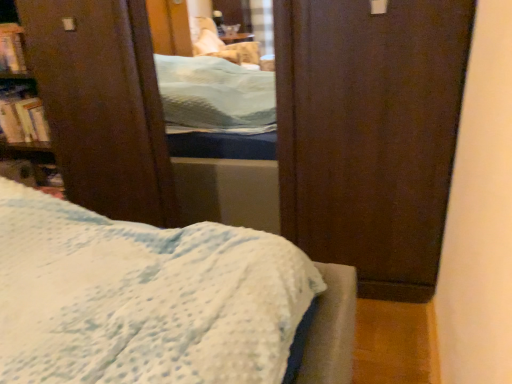
The width and height of the screenshot is (512, 384). In order to click on hardcover book at left, which is the 2th book from top to bottom in this screenshot , I will do `click(22, 116)`.

Describe the element at coordinates (22, 116) in the screenshot. I see `hardcover book at left, which is the 2th book from top to bottom` at that location.

How much space does hardcover book at upper left, positioned as the second book in bottom-to-top order, occupy horizontally?

It is 7.41 inches.

In order to face hardcover book at upper left, positioned as the second book in bottom-to-top order, should I rotate leftwards or rightwards?

Turn left by 31.420 degrees to look at hardcover book at upper left, positioned as the second book in bottom-to-top order.

Where is `hardcover book at upper left, placed as the 1th book when sorted from top to bottom`? hardcover book at upper left, placed as the 1th book when sorted from top to bottom is located at coordinates (12, 49).

The height and width of the screenshot is (384, 512). Describe the element at coordinates (12, 49) in the screenshot. I see `hardcover book at upper left, positioned as the second book in bottom-to-top order` at that location.

Find the location of a particular element. The height and width of the screenshot is (384, 512). hardcover book at left, which is the 2th book from top to bottom is located at coordinates (22, 116).

Is hardcover book at upper left, positioned as the second book in bottom-to-top order, to the right of hardcover book at left, which is the 2th book from top to bottom, from the viewer's perspective?

Incorrect, hardcover book at upper left, positioned as the second book in bottom-to-top order, is not on the right side of hardcover book at left, which is the 2th book from top to bottom.

Considering their positions, is hardcover book at upper left, positioned as the second book in bottom-to-top order, located in front of or behind hardcover book at left, which is the 2th book from top to bottom?

hardcover book at upper left, positioned as the second book in bottom-to-top order, is positioned closer to the viewer than hardcover book at left, which is the 2th book from top to bottom.

Does point (18, 72) lie behind point (17, 90)?

That is False.

From the image's perspective, is hardcover book at upper left, placed as the 1th book when sorted from top to bottom, positioned above or below hardcover book at left, marked as the 1th book in a bottom-to-top arrangement?

Clearly, from the image's perspective, hardcover book at upper left, placed as the 1th book when sorted from top to bottom, is above hardcover book at left, marked as the 1th book in a bottom-to-top arrangement.

From a real-world perspective, relative to hardcover book at left, marked as the 1th book in a bottom-to-top arrangement, is hardcover book at upper left, positioned as the second book in bottom-to-top order, vertically above or below?

Clearly, from a real-world perspective, hardcover book at upper left, positioned as the second book in bottom-to-top order, is above hardcover book at left, marked as the 1th book in a bottom-to-top arrangement.

Considering the relative sizes of hardcover book at upper left, placed as the 1th book when sorted from top to bottom, and hardcover book at left, marked as the 1th book in a bottom-to-top arrangement, in the image provided, is hardcover book at upper left, placed as the 1th book when sorted from top to bottom, thinner than hardcover book at left, marked as the 1th book in a bottom-to-top arrangement,?

Indeed, hardcover book at upper left, placed as the 1th book when sorted from top to bottom, has a lesser width compared to hardcover book at left, marked as the 1th book in a bottom-to-top arrangement.

Between hardcover book at upper left, positioned as the second book in bottom-to-top order, and hardcover book at left, which is the 2th book from top to bottom, which one has less height?

With less height is hardcover book at left, which is the 2th book from top to bottom.

Who is smaller, hardcover book at upper left, positioned as the second book in bottom-to-top order, or hardcover book at left, marked as the 1th book in a bottom-to-top arrangement?

Smaller between the two is hardcover book at left, marked as the 1th book in a bottom-to-top arrangement.

Is hardcover book at left, which is the 2th book from top to bottom, completely or partially inside hardcover book at upper left, placed as the 1th book when sorted from top to bottom?

That's incorrect, hardcover book at left, which is the 2th book from top to bottom, is not inside hardcover book at upper left, placed as the 1th book when sorted from top to bottom.

Can you see hardcover book at upper left, positioned as the second book in bottom-to-top order, touching hardcover book at left, which is the 2th book from top to bottom?

No, hardcover book at upper left, positioned as the second book in bottom-to-top order, is not with hardcover book at left, which is the 2th book from top to bottom.

Is hardcover book at upper left, positioned as the second book in bottom-to-top order, oriented towards hardcover book at left, which is the 2th book from top to bottom?

No, hardcover book at upper left, positioned as the second book in bottom-to-top order, is not facing towards hardcover book at left, which is the 2th book from top to bottom.

Where is `book below the hardcover book at upper left, positioned as the second book in bottom-to-top order (from the image's perspective)`? book below the hardcover book at upper left, positioned as the second book in bottom-to-top order (from the image's perspective) is located at coordinates tap(22, 116).

Would you say hardcover book at left, marked as the 1th book in a bottom-to-top arrangement, is to the left or to the right of hardcover book at upper left, placed as the 1th book when sorted from top to bottom, in the picture?

In the image, hardcover book at left, marked as the 1th book in a bottom-to-top arrangement, appears on the right side of hardcover book at upper left, placed as the 1th book when sorted from top to bottom.

Which object is more forward, hardcover book at left, which is the 2th book from top to bottom, or hardcover book at upper left, positioned as the second book in bottom-to-top order?

hardcover book at upper left, positioned as the second book in bottom-to-top order, is in front.

Considering the positions of points (15, 138) and (12, 35), is point (15, 138) farther from camera compared to point (12, 35)?

That is True.

From the image's perspective, which one is positioned higher, hardcover book at left, which is the 2th book from top to bottom, or hardcover book at upper left, placed as the 1th book when sorted from top to bottom?

From the image's view, hardcover book at upper left, placed as the 1th book when sorted from top to bottom, is above.

From a real-world perspective, is hardcover book at left, which is the 2th book from top to bottom, on hardcover book at upper left, positioned as the second book in bottom-to-top order?

Incorrect, from a real-world perspective, hardcover book at left, which is the 2th book from top to bottom, is lower than hardcover book at upper left, positioned as the second book in bottom-to-top order.

Considering the relative sizes of hardcover book at left, marked as the 1th book in a bottom-to-top arrangement, and hardcover book at upper left, placed as the 1th book when sorted from top to bottom, in the image provided, is hardcover book at left, marked as the 1th book in a bottom-to-top arrangement, wider than hardcover book at upper left, placed as the 1th book when sorted from top to bottom,?

Yes.

From their relative heights in the image, would you say hardcover book at left, which is the 2th book from top to bottom, is taller or shorter than hardcover book at upper left, positioned as the second book in bottom-to-top order?

In the image, hardcover book at left, which is the 2th book from top to bottom, appears to be shorter than hardcover book at upper left, positioned as the second book in bottom-to-top order.

Which of these two, hardcover book at left, marked as the 1th book in a bottom-to-top arrangement, or hardcover book at upper left, positioned as the second book in bottom-to-top order, is smaller?

hardcover book at left, marked as the 1th book in a bottom-to-top arrangement.

Is hardcover book at left, marked as the 1th book in a bottom-to-top arrangement, surrounding hardcover book at upper left, positioned as the second book in bottom-to-top order?

Actually, hardcover book at upper left, positioned as the second book in bottom-to-top order, is outside hardcover book at left, marked as the 1th book in a bottom-to-top arrangement.

Are hardcover book at left, marked as the 1th book in a bottom-to-top arrangement, and hardcover book at upper left, positioned as the second book in bottom-to-top order, making contact?

hardcover book at left, marked as the 1th book in a bottom-to-top arrangement, and hardcover book at upper left, positioned as the second book in bottom-to-top order, are not in contact.

Is hardcover book at left, marked as the 1th book in a bottom-to-top arrangement, aimed at hardcover book at upper left, placed as the 1th book when sorted from top to bottom?

No, hardcover book at left, marked as the 1th book in a bottom-to-top arrangement, is not aimed at hardcover book at upper left, placed as the 1th book when sorted from top to bottom.

Can you tell me how much hardcover book at left, which is the 2th book from top to bottom, and hardcover book at upper left, placed as the 1th book when sorted from top to bottom, differ in facing direction?

There is a 2.26-degree angle between the facing directions of hardcover book at left, which is the 2th book from top to bottom, and hardcover book at upper left, placed as the 1th book when sorted from top to bottom.

Image resolution: width=512 pixels, height=384 pixels. What are the coordinates of `book that is under the hardcover book at upper left, positioned as the second book in bottom-to-top order (from a real-world perspective)` in the screenshot? It's located at (22, 116).

I want to click on book above the hardcover book at left, which is the 2th book from top to bottom (from the image's perspective), so click(12, 49).

Identify the location of book behind the hardcover book at upper left, positioned as the second book in bottom-to-top order. (22, 116).